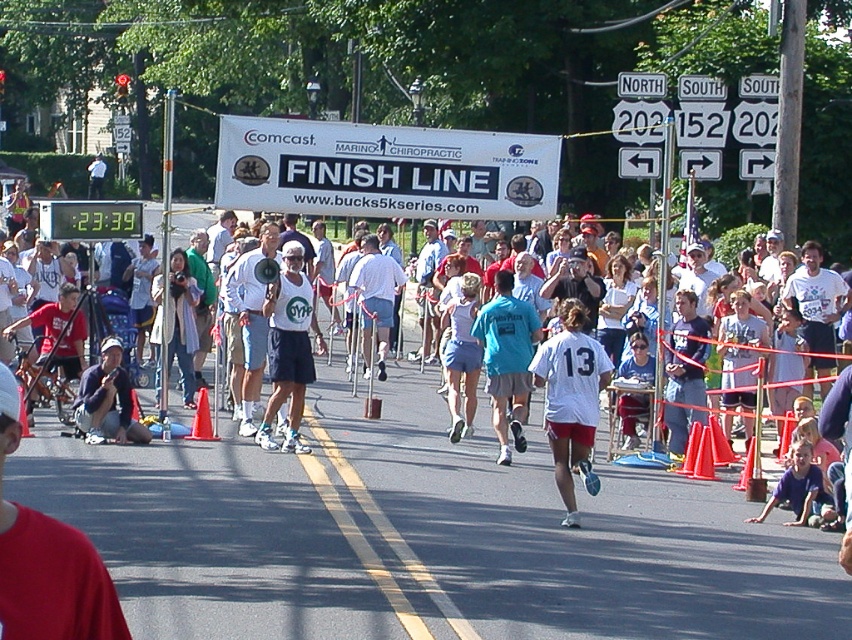
Question: Is white paper banner at center below dark blue shorts at lower left?

Choices:
 (A) no
 (B) yes

Answer: (A)

Question: Estimate the real-world distances between objects in this image. Which object is farther from the teal fabric shirt at center?

Choices:
 (A) white matte megaphone at center
 (B) white cotton shirt at center
 (C) dark blue shorts at lower left
 (D) white matte shirt at center

Answer: (C)

Question: Which point appears closest to the camera in this image?

Choices:
 (A) (545, 346)
 (B) (298, 381)
 (C) (522, 328)

Answer: (A)

Question: Which point is closer to the camera taking this photo?

Choices:
 (A) (540, 212)
 (B) (591, 480)
 (C) (486, 305)

Answer: (B)

Question: Does teal fabric shirt at center have a larger size compared to light blue shorts at center?

Choices:
 (A) yes
 (B) no

Answer: (B)

Question: Does dark blue shorts at lower left appear on the left side of light blue shorts at center?

Choices:
 (A) no
 (B) yes

Answer: (B)